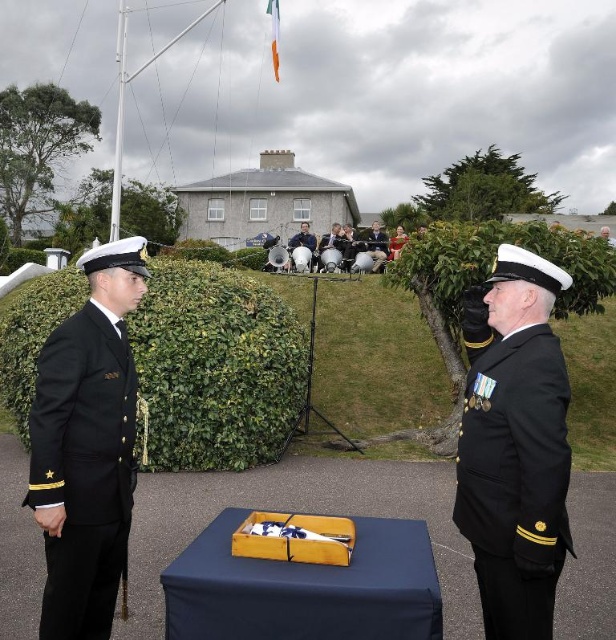
You are a photographer standing at the edge of the grassy area. You need to take a photo that includes both the green leafy hedge at center and the dark blue uniform at center. Given that your camera has a maximum focus range of 10 meters, will you be able to capture both subjects clearly in the same frame?

The green leafy hedge at center is 11.53 meters from the dark blue uniform at center. Since the distance between them exceeds the camera maximum focus range of 10 meters, you cannot capture both subjects clearly in the same frame.

You are an event planner arranging seating for a ceremony. You need to place a chair for the smooth white uniform at center and another for the dark blue uniform at center. Which chair should be placed closer to the front of the stage?

The smooth white uniform at center is shorter than the dark blue uniform at center, so the chair for the smooth white uniform at center should be placed closer to the front of the stage to ensure visibility.

You are a photographer at this military ceremony. You need to capture a photo where both the green leafy hedge at center and the dark blue uniform at center are visible. Given their sizes, which object should you focus on to ensure both fit in the frame?

The green leafy hedge at center is smaller than the dark blue uniform at center. To ensure both fit in the frame, focus on the dark blue uniform at center since it is larger and will require more space, allowing the smaller hedge to also be captured.